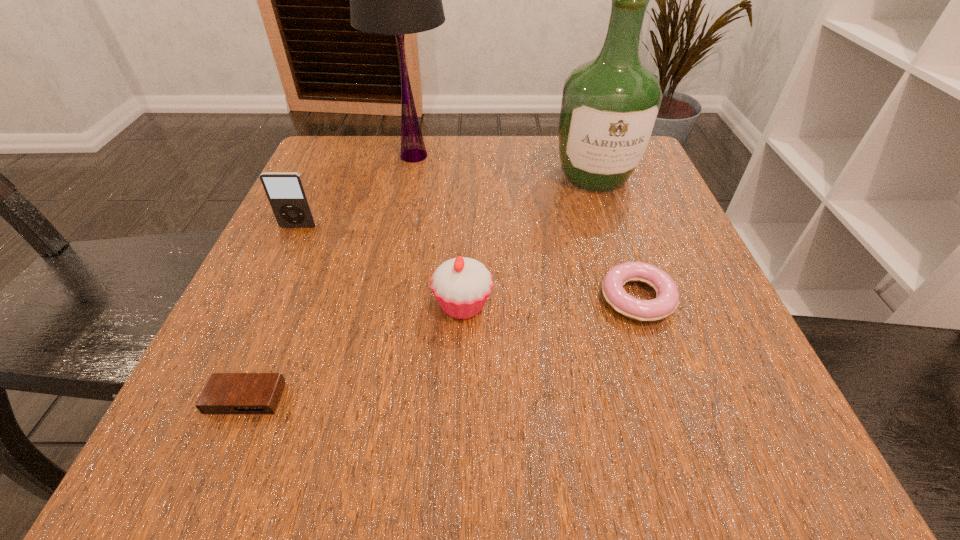
Where is `liquor that is at the right edge`? liquor that is at the right edge is located at coordinates (610, 105).

Locate an element on the screen. doughnut that is at the right edge is located at coordinates (667, 299).

Identify the location of object present at the far left corner. (396, 0).

Locate an element on the screen. The height and width of the screenshot is (540, 960). object that is positioned at the near left corner is located at coordinates (225, 393).

This screenshot has height=540, width=960. What are the coordinates of `object that is at the far right corner` in the screenshot? It's located at (610, 105).

Where is `vacant space at the far edge`? vacant space at the far edge is located at coordinates pos(504,153).

Identify the location of vacant area at the near edge of the desktop. This screenshot has height=540, width=960. (571, 411).

This screenshot has height=540, width=960. In the image, there is a desktop. What are the coordinates of `vacant space at the left edge` in the screenshot? It's located at (239, 320).

At what (x,y) coordinates should I click in order to perform the action: click on vacant space at the right edge. Please return your answer as a coordinate pair (x, y). Looking at the image, I should click on (672, 274).

This screenshot has width=960, height=540. What are the coordinates of `vacant point at the far left corner` in the screenshot? It's located at (369, 148).